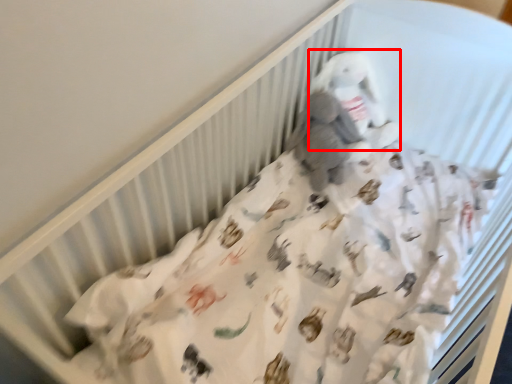
Question: From the image, what is the correct spatial relationship of toy (annotated by the red box) in relation to baby elephant?

Choices:
 (A) left
 (B) right

Answer: (B)